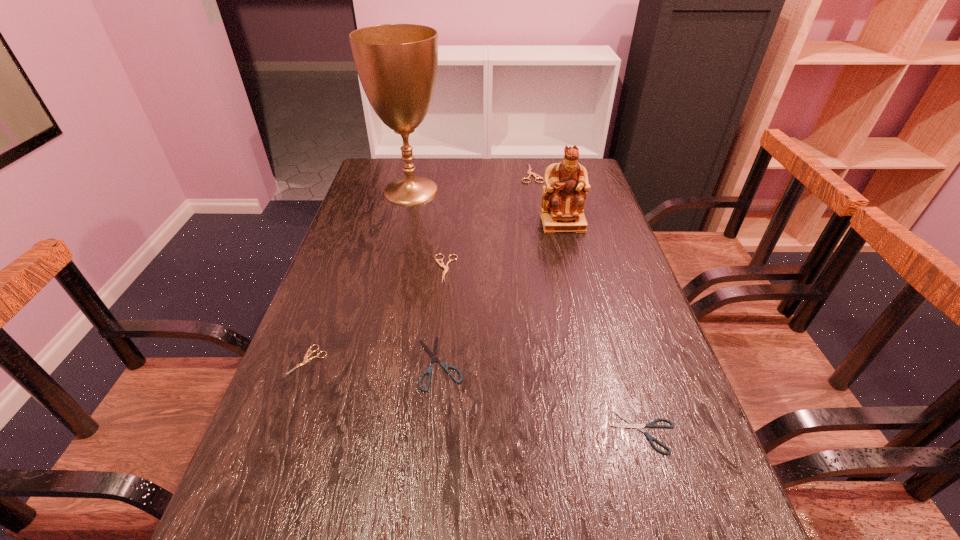
Identify which shears is located as the third nearest to the left black shears. Please provide its 2D coordinates. Your answer should be formatted as a tuple, i.e. [(x, y)], where the tuple contains the x and y coordinates of a point satisfying the conditions above.

[(633, 425)]

Identify which beige shears is the nearest to the trophy cup. Please provide its 2D coordinates. Your answer should be formatted as a tuple, i.e. [(x, y)], where the tuple contains the x and y coordinates of a point satisfying the conditions above.

[(438, 261)]

Locate which beige shears ranks second in proximity to the second tallest object. Please provide its 2D coordinates. Your answer should be formatted as a tuple, i.e. [(x, y)], where the tuple contains the x and y coordinates of a point satisfying the conditions above.

[(438, 261)]

Image resolution: width=960 pixels, height=540 pixels. I want to click on the closest black shears relative to the tallest object, so click(433, 354).

You are a GUI agent. You are given a task and a screenshot of the screen. Output one action in this format:
    pyautogui.click(x=<x>, y=<y>)
    Task: Click on the second closest black shears to the fifth nearest object
    The width and height of the screenshot is (960, 540).
    Given the screenshot: What is the action you would take?
    pyautogui.click(x=633, y=425)

At what (x,y) coordinates should I click in order to perform the action: click on vacant space that satisfies the following two spatial constraints: 1. on the front side of the tallest object; 2. on the right side of the smaller black shears. Please return your answer as a coordinate pair (x, y). Looking at the image, I should click on (356, 432).